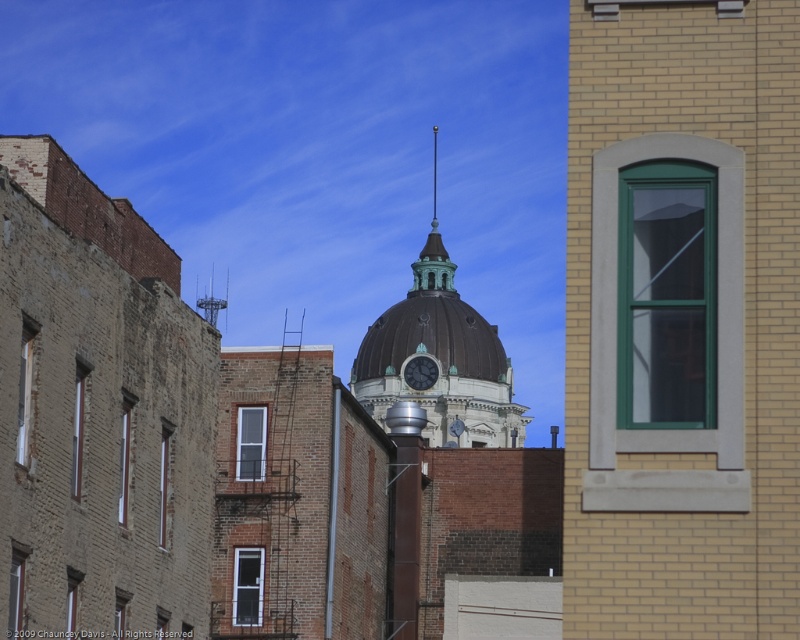
Is green patina spire at center above matte black clock at center?

Correct, green patina spire at center is located above matte black clock at center.

Between point (436, 212) and point (424, 387), which one is positioned behind?

The point (436, 212) is more distant.

Is point (424, 289) less distant than point (430, 380)?

No, (424, 289) is behind (430, 380).

The width and height of the screenshot is (800, 640). What are the coordinates of `green patina spire at center` in the screenshot? It's located at (433, 252).

Can you confirm if brown dome at center is bigger than matte black clock at center?

Correct, brown dome at center is larger in size than matte black clock at center.

Between point (388, 323) and point (428, 371), which one is positioned in front?

Point (428, 371) is more forward.

Locate an element on the screen. brown dome at center is located at coordinates (440, 356).

Does matte black clock at center have a lesser height compared to metallic spire at upper center?

Yes, matte black clock at center is shorter than metallic spire at upper center.

Is point (408, 381) farther from viewer compared to point (197, 307)?

No, it is in front of (197, 307).

Describe the element at coordinates (420, 372) in the screenshot. I see `matte black clock at center` at that location.

Image resolution: width=800 pixels, height=640 pixels. Identify the location of matte black clock at center. (420, 372).